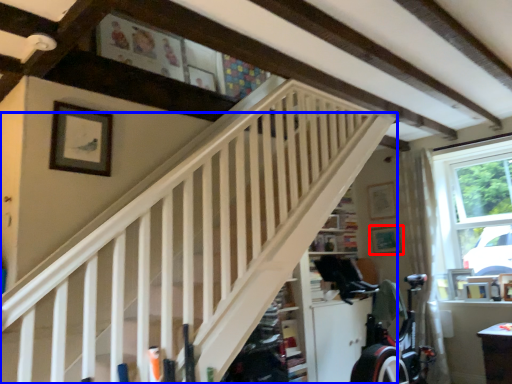
Question: Which of the following is the farthest to the observer, picture frame (highlighted by a red box) or stairs (highlighted by a blue box)?

Choices:
 (A) picture frame
 (B) stairs

Answer: (A)